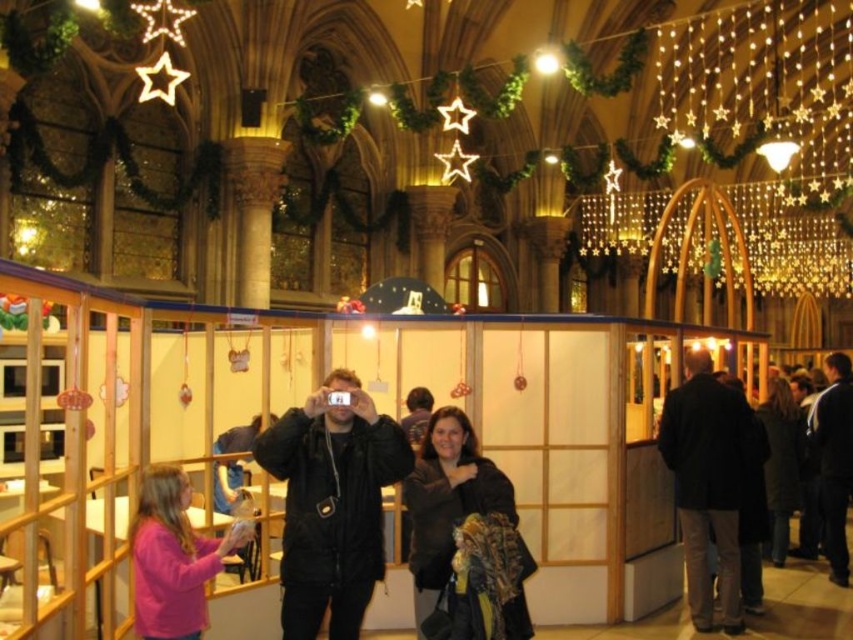
You are standing in front of the booth at the event and see the pink matte jacket at lower left and the dark brown leather jacket at right. Which jacket is nearer to you?

The pink matte jacket at lower left is closer to the viewer than the dark brown leather jacket at right.

You are standing in the historic building and see a point marked at coordinates (447, 500). What object is this point located on?

The point marked at coordinates (447, 500) is located on the dark brown leather jacket at center.

What are the coordinates of the dark brown leather jacket at center?

The dark brown leather jacket at center is located at coordinates point (447, 500).